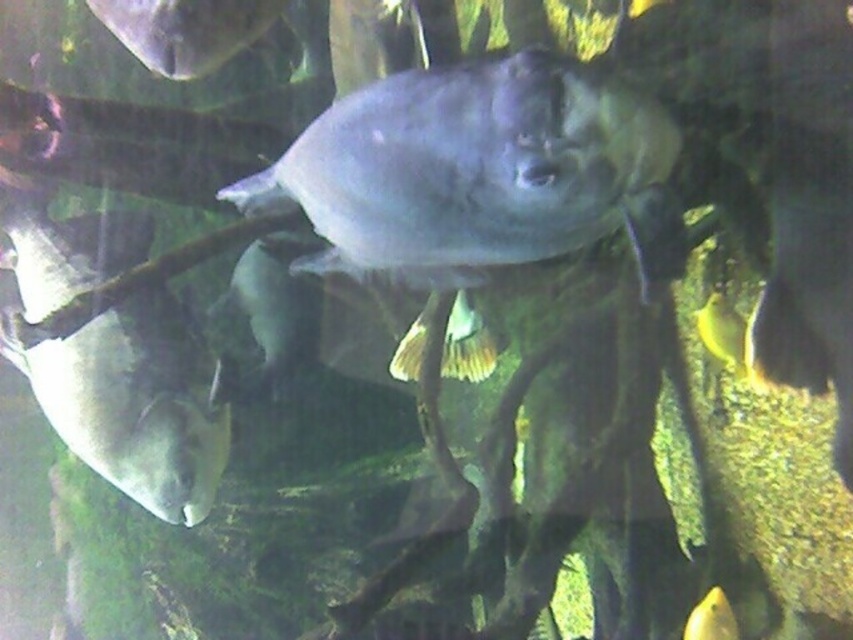
Measure the distance between shiny silver fish at center and camera.

shiny silver fish at center is 1.04 meters away from camera.

Locate an element on the screen. The image size is (853, 640). shiny silver fish at center is located at coordinates (477, 172).

Between shiny silver fish at center and matte gray fish at lower left, which one appears on the right side from the viewer's perspective?

shiny silver fish at center

Which is more to the left, shiny silver fish at center or matte gray fish at lower left?

matte gray fish at lower left

Identify the location of shiny silver fish at center. The height and width of the screenshot is (640, 853). (477, 172).

Image resolution: width=853 pixels, height=640 pixels. Find the location of `shiny silver fish at center`. shiny silver fish at center is located at coordinates 477,172.

Does point (413, 184) lie behind point (708, 632)?

No.

Is shiny silver fish at center to the left of yellow matte fish at lower right from the viewer's perspective?

Yes, shiny silver fish at center is to the left of yellow matte fish at lower right.

Identify the location of shiny silver fish at center. (477, 172).